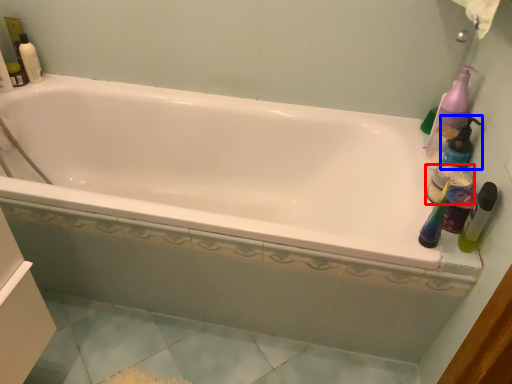
Question: Which object is closer to the camera taking this photo, mouthwash (highlighted by a red box) or cleaning product (highlighted by a blue box)?

Choices:
 (A) mouthwash
 (B) cleaning product

Answer: (B)